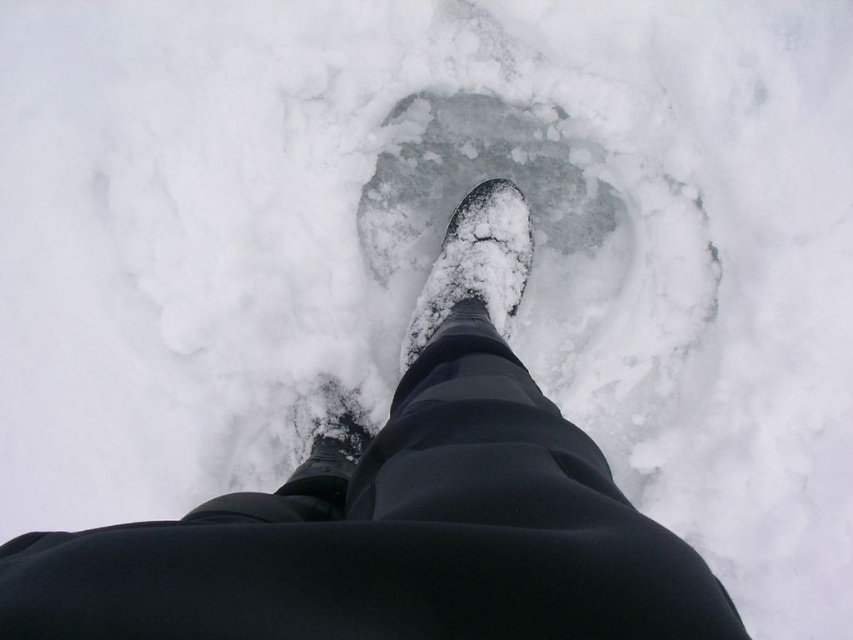
Question: Among these objects, which one is nearest to the camera?

Choices:
 (A) snow-covered boot at center
 (B) shiny black boot at center
 (C) matte black boot at lower center

Answer: (B)

Question: Which point is closer to the camera?

Choices:
 (A) matte black boot at lower center
 (B) snow-covered boot at center

Answer: (A)

Question: Does shiny black boot at center appear on the right side of snow-covered boot at center?

Choices:
 (A) yes
 (B) no

Answer: (B)

Question: Which point is closer to the camera?

Choices:
 (A) snow-covered boot at center
 (B) shiny black boot at center
 (C) matte black boot at lower center

Answer: (B)

Question: Is shiny black boot at center below matte black boot at lower center?

Choices:
 (A) yes
 (B) no

Answer: (B)

Question: Does shiny black boot at center appear under snow-covered boot at center?

Choices:
 (A) yes
 (B) no

Answer: (A)